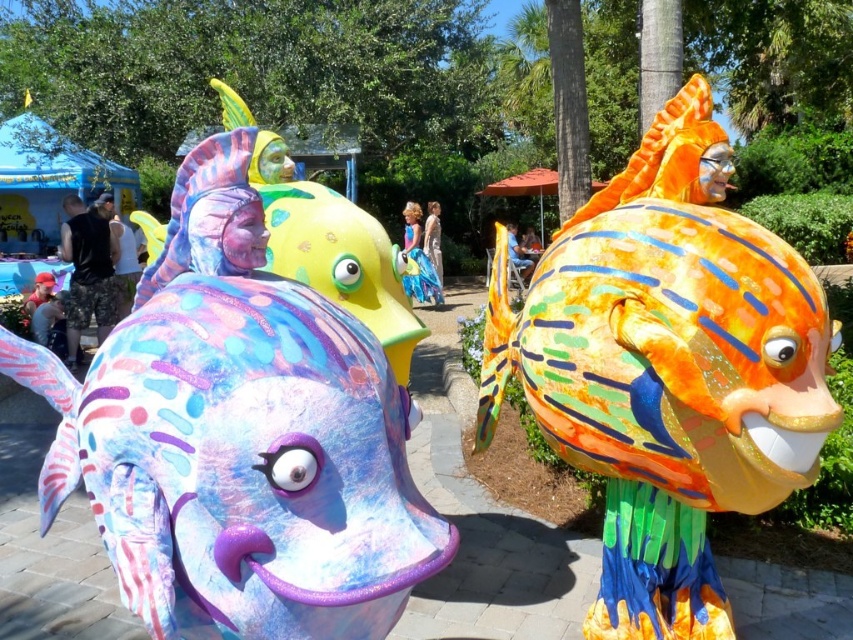
Question: Which point is closer to the camera?

Choices:
 (A) (666, 349)
 (B) (363, 461)

Answer: (B)

Question: Is pastel painted fish at center bigger than shiny orange fish at center?

Choices:
 (A) yes
 (B) no

Answer: (B)

Question: Which of the following is the farthest from the observer?

Choices:
 (A) (316, 515)
 (B) (808, 442)

Answer: (B)

Question: Which point is farther to the camera?

Choices:
 (A) pastel painted fish at center
 (B) shiny orange fish at center

Answer: (B)

Question: Can you confirm if pastel painted fish at center is positioned to the right of shiny orange fish at center?

Choices:
 (A) no
 (B) yes

Answer: (A)

Question: Is pastel painted fish at center above shiny orange fish at center?

Choices:
 (A) no
 (B) yes

Answer: (A)